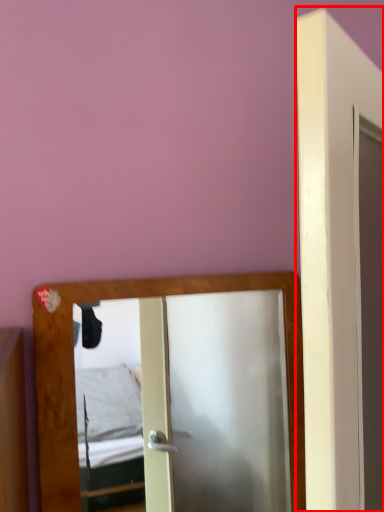
Question: From the image's perspective, what is the correct spatial relationship of door (annotated by the red box) in relation to mirror?

Choices:
 (A) above
 (B) below

Answer: (A)